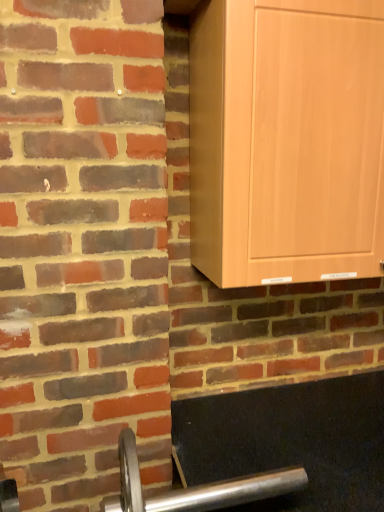
At what (x,y) coordinates should I click in order to perform the action: click on light brown wood cabinet at right. Please return your answer as a coordinate pair (x, y). This screenshot has width=384, height=512. Looking at the image, I should click on (286, 140).

Image resolution: width=384 pixels, height=512 pixels. What do you see at coordinates (286, 140) in the screenshot? I see `light brown wood cabinet at right` at bounding box center [286, 140].

This screenshot has height=512, width=384. Identify the location of light brown wood cabinet at right. (286, 140).